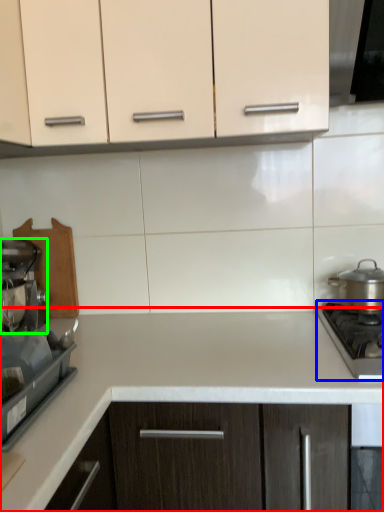
Question: Based on their relative distances, which object is nearer to countertop (highlighted by a red box)? Choose from gas stove (highlighted by a blue box) and kitchen appliance (highlighted by a green box).

Choices:
 (A) gas stove
 (B) kitchen appliance

Answer: (A)